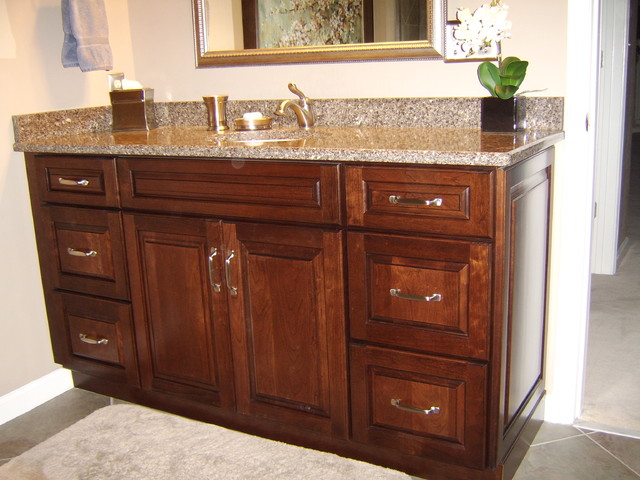
This screenshot has height=480, width=640. Find the location of `faucet`. faucet is located at coordinates (280, 113).